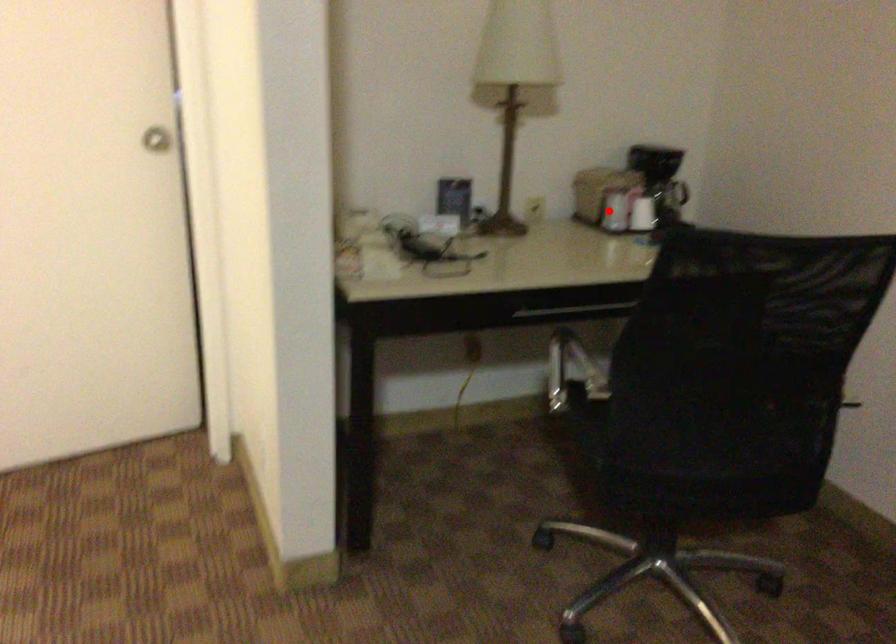
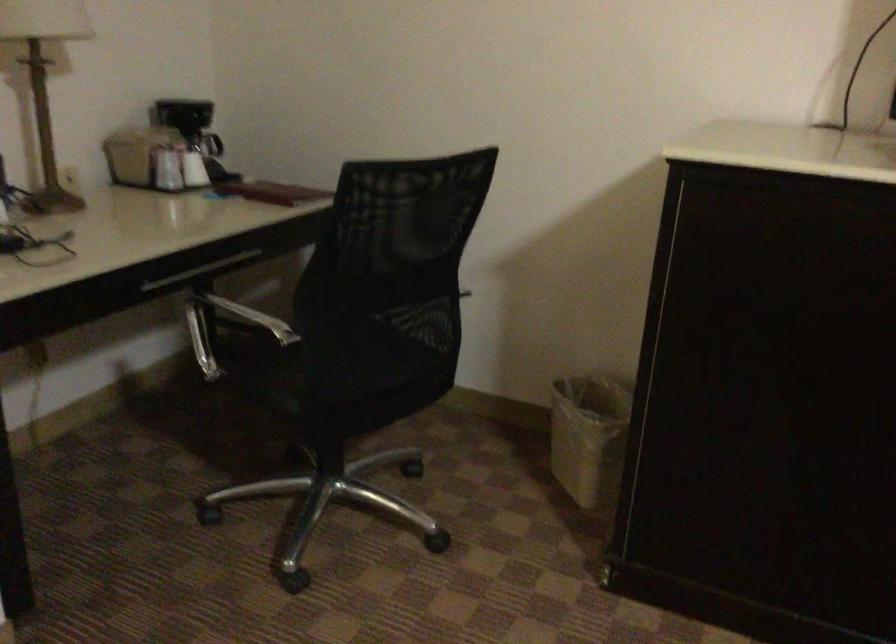
Find the pixel in the second image that matches the highlighted location in the first image.

(165, 169)